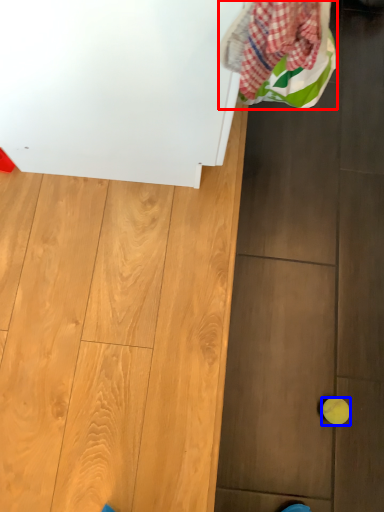
Question: Which of the following is the farthest to the observer, laundry (highlighted by a red box) or ball (highlighted by a blue box)?

Choices:
 (A) laundry
 (B) ball

Answer: (B)